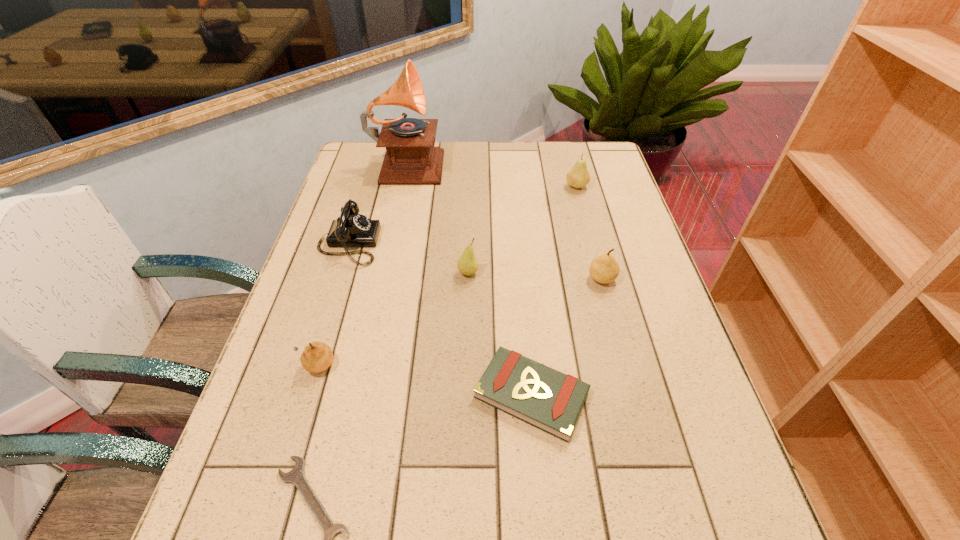
This screenshot has height=540, width=960. I want to click on free region located 0.110m on the dial of the telephone, so click(419, 244).

This screenshot has height=540, width=960. What are the coordinates of `vacant space situated on the right of the nearest pear` in the screenshot? It's located at [434, 366].

Find the location of a particular element. Image resolution: width=960 pixels, height=540 pixels. free space located on the right of the second shortest object is located at coordinates (678, 395).

Where is `object that is positioned at the far edge`? This screenshot has width=960, height=540. object that is positioned at the far edge is located at coordinates (411, 158).

You are a GUI agent. You are given a task and a screenshot of the screen. Output one action in this format:
    pyautogui.click(x=<x>, y=<y>)
    Task: Click on the phonograph record that is at the left edge
    
    Given the screenshot: What is the action you would take?
    pyautogui.click(x=411, y=158)

Find the location of `telephone located at the left edge`. telephone located at the left edge is located at coordinates (351, 229).

At what (x,y) coordinates should I click in order to perform the action: click on pear present at the left edge. Please return your answer as a coordinate pair (x, y). The image size is (960, 540). Looking at the image, I should click on (317, 356).

This screenshot has width=960, height=540. Find the location of `object that is positioned at the far left corner`. object that is positioned at the far left corner is located at coordinates click(411, 158).

Where is `vacant space at the far edge of the desktop`? This screenshot has height=540, width=960. vacant space at the far edge of the desktop is located at coordinates (544, 162).

Identify the location of free region at the left edge of the desktop. This screenshot has height=540, width=960. (366, 260).